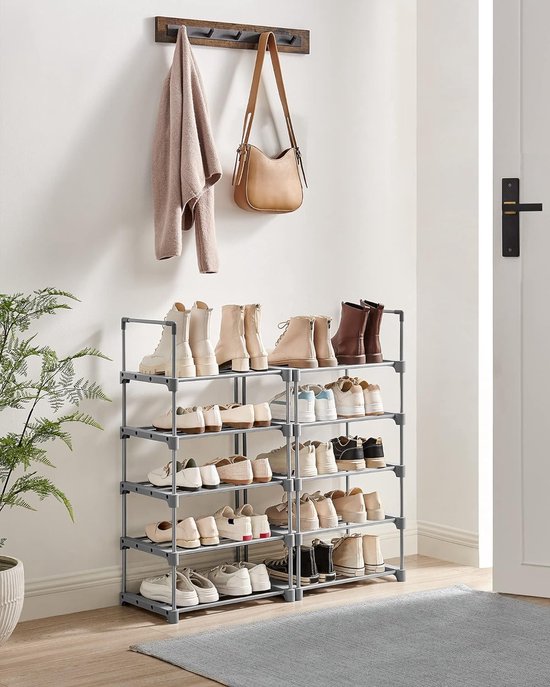
The width and height of the screenshot is (550, 687). In order to click on shelf in this screenshot , I will do `click(153, 605)`, `click(151, 554)`, `click(157, 488)`, `click(151, 436)`, `click(151, 378)`, `click(320, 365)`, `click(328, 423)`, `click(335, 471)`, `click(337, 529)`, `click(340, 578)`.